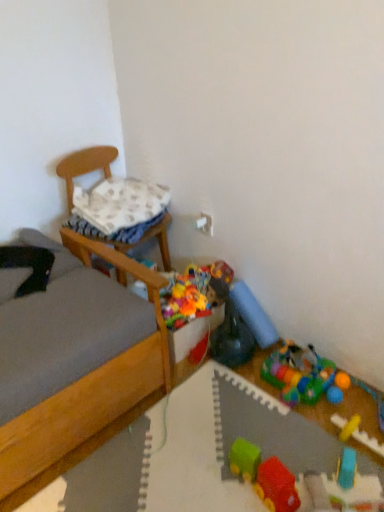
This screenshot has height=512, width=384. I want to click on free location in front of rubberized plastic play mat at lower right, the third toy viewed from the back, so click(x=310, y=420).